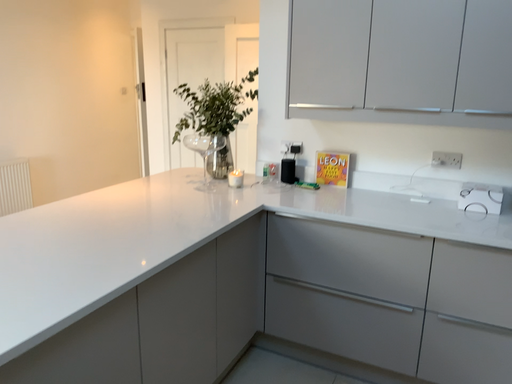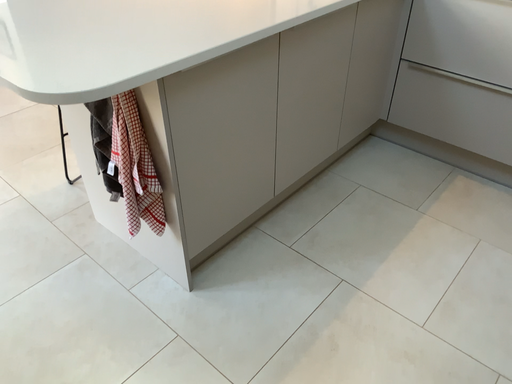
Question: How did the camera likely rotate when shooting the video?

Choices:
 (A) rotated left
 (B) rotated right

Answer: (A)